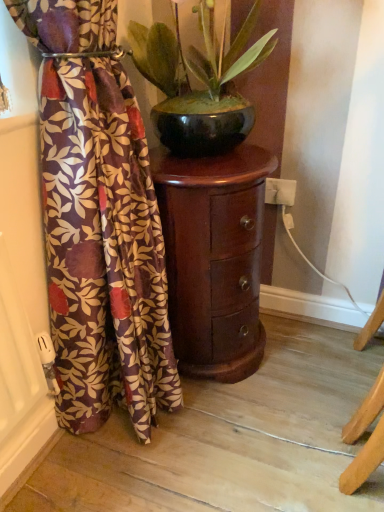
What do you see at coordinates (103, 249) in the screenshot? This screenshot has width=384, height=512. I see `velvet floral curtain at left` at bounding box center [103, 249].

Describe the element at coordinates (214, 258) in the screenshot. I see `mahogany wood side table at center` at that location.

The height and width of the screenshot is (512, 384). Identify the location of glossy ceramic pot at center. (201, 82).

Locate an element on the screen. velvet floral curtain at left is located at coordinates (103, 249).

Is glossy ceramic pot at center beside velvet floral curtain at left?

No, glossy ceramic pot at center is not in contact with velvet floral curtain at left.

Looking at this image, is glossy ceramic pot at center aimed at velvet floral curtain at left?

No, glossy ceramic pot at center is not aimed at velvet floral curtain at left.

How many degrees apart are the facing directions of glossy ceramic pot at center and velvet floral curtain at left?

The facing directions of glossy ceramic pot at center and velvet floral curtain at left are 2.73 degrees apart.

In terms of height, does glossy ceramic pot at center look taller or shorter compared to velvet floral curtain at left?

In the image, glossy ceramic pot at center appears to be shorter than velvet floral curtain at left.

From a real-world perspective, is mahogany wood side table at center positioned over glossy ceramic pot at center based on gravity?

Actually, mahogany wood side table at center is physically below glossy ceramic pot at center in the real world.

Is mahogany wood side table at center oriented away from glossy ceramic pot at center?

No.

From the image's perspective, is mahogany wood side table at center positioned above or below glossy ceramic pot at center?

mahogany wood side table at center is situated lower than glossy ceramic pot at center in the image.

Locate an element on the screen. The image size is (384, 512). furniture directly beneath the glossy ceramic pot at center (from a real-world perspective) is located at coordinates (214, 258).

Which is more to the left, velvet floral curtain at left or mahogany wood side table at center?

velvet floral curtain at left is more to the left.

Considering the relative sizes of velvet floral curtain at left and mahogany wood side table at center in the image provided, is velvet floral curtain at left shorter than mahogany wood side table at center?

Incorrect, the height of velvet floral curtain at left does not fall short of that of mahogany wood side table at center.

Can you confirm if velvet floral curtain at left is thinner than mahogany wood side table at center?

Yes.

Is point (86, 291) closer to viewer compared to point (211, 350)?

Yes, point (86, 291) is in front of point (211, 350).

Is velvet floral curtain at left not inside glossy ceramic pot at center?

velvet floral curtain at left is positioned outside glossy ceramic pot at center.

Could you tell me if velvet floral curtain at left is facing glossy ceramic pot at center?

No, velvet floral curtain at left is not facing towards glossy ceramic pot at center.

Is velvet floral curtain at left placed right next to glossy ceramic pot at center?

No, velvet floral curtain at left is not with glossy ceramic pot at center.

Can you confirm if mahogany wood side table at center is wider than velvet floral curtain at left?

Yes, mahogany wood side table at center is wider than velvet floral curtain at left.

Which object is positioned more to the left, mahogany wood side table at center or velvet floral curtain at left?

From the viewer's perspective, velvet floral curtain at left appears more on the left side.

Is mahogany wood side table at center bigger than velvet floral curtain at left?

Actually, mahogany wood side table at center might be smaller than velvet floral curtain at left.

Is mahogany wood side table at center shorter than velvet floral curtain at left?

Correct, mahogany wood side table at center is not as tall as velvet floral curtain at left.

Between glossy ceramic pot at center and mahogany wood side table at center, which one has smaller width?

Thinner between the two is mahogany wood side table at center.

From the image's perspective, which is below, glossy ceramic pot at center or mahogany wood side table at center?

mahogany wood side table at center is shown below in the image.

Is there a large distance between glossy ceramic pot at center and mahogany wood side table at center?

Actually, glossy ceramic pot at center and mahogany wood side table at center are a little close together.

Between point (216, 73) and point (176, 337), which one is positioned behind?

Point (176, 337)

You are a GUI agent. You are given a task and a screenshot of the screen. Output one action in this format:
    pyautogui.click(x=<x>, y=<y>)
    Task: Click on the curtain below the glossy ceramic pot at center (from a real-world perspective)
    This screenshot has width=384, height=512.
    Given the screenshot: What is the action you would take?
    pyautogui.click(x=103, y=249)

Where is `houseplant above the mahogany wood side table at center (from a real-world perspective)`? This screenshot has width=384, height=512. houseplant above the mahogany wood side table at center (from a real-world perspective) is located at coordinates (201, 82).

Based on their spatial positions, is velvet floral curtain at left or glossy ceramic pot at center further from mahogany wood side table at center?

glossy ceramic pot at center is further to mahogany wood side table at center.

In the scene shown: Based on their spatial positions, is mahogany wood side table at center or glossy ceramic pot at center further from velvet floral curtain at left?

The object further to velvet floral curtain at left is glossy ceramic pot at center.

Based on their spatial positions, is glossy ceramic pot at center or mahogany wood side table at center closer to velvet floral curtain at left?

mahogany wood side table at center.

Looking at the image, which one is located further to glossy ceramic pot at center, velvet floral curtain at left or mahogany wood side table at center?

velvet floral curtain at left is further to glossy ceramic pot at center.

In the scene shown: Which object lies further to the anchor point glossy ceramic pot at center, mahogany wood side table at center or velvet floral curtain at left?

The object further to glossy ceramic pot at center is velvet floral curtain at left.

Looking at the image, which one is located closer to mahogany wood side table at center, glossy ceramic pot at center or velvet floral curtain at left?

Based on the image, velvet floral curtain at left appears to be nearer to mahogany wood side table at center.

Locate an element on the screen. This screenshot has height=512, width=384. curtain between glossy ceramic pot at center and mahogany wood side table at center in the up-down direction is located at coordinates (103, 249).